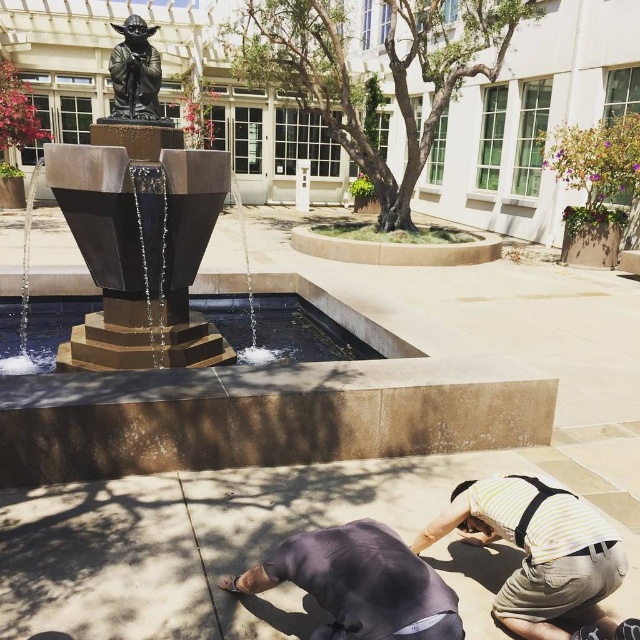
You are a visitor at this location and want to place a small potted plant between the dark gray fabric squat at lower center and the bronze statue at center. Considering their sizes, which object should the plant be closer to?

The dark gray fabric squat at lower center is larger in size than the bronze statue at center, so the plant should be placed closer to the bronze statue at center to maintain balance.

You are standing at the entrance of the building and want to walk towards the fountain. There are two points marked in the scene, point 1 at coordinates point (566, 516) and point 2 at coordinates point (112, 116). Which point is closer to you as you face the fountain?

Point (566, 516) is closer to the viewer than point (112, 116), so the closer point is point 1.

You are standing near the fountain and see the yellow striped shirt at lower right and the dark gray fabric squat at lower center. Which object is closer to you?

The yellow striped shirt at lower right is closer to you because it is further to the viewer than the dark gray fabric squat at lower center.